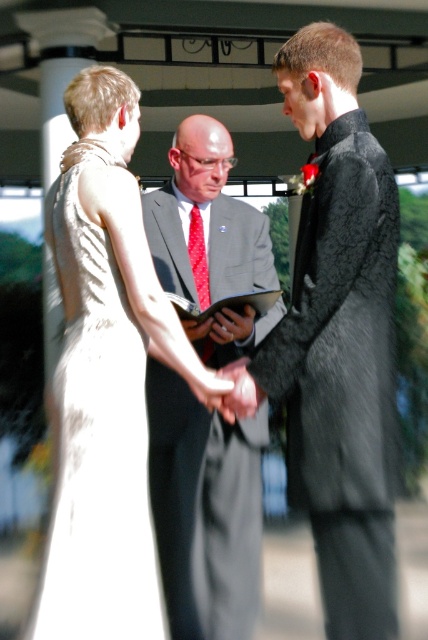
Question: Can you confirm if black textured suit at center is positioned above matte gray suit at center?

Choices:
 (A) yes
 (B) no

Answer: (A)

Question: Which point appears closest to the camera in this image?

Choices:
 (A) (345, 166)
 (B) (174, 161)
 (C) (104, 292)

Answer: (A)

Question: Estimate the real-world distances between objects in this image. Which object is closer to the matte gray suit at center?

Choices:
 (A) black textured suit at center
 (B) ivory satin dress at left

Answer: (B)

Question: Which object appears farthest from the camera in this image?

Choices:
 (A) ivory satin dress at left
 (B) matte gray suit at center
 (C) black textured suit at center

Answer: (B)

Question: Considering the relative positions of black textured suit at center and ivory satin dress at left in the image provided, where is black textured suit at center located with respect to ivory satin dress at left?

Choices:
 (A) left
 (B) right

Answer: (B)

Question: Is black textured suit at center wider than matte gray suit at center?

Choices:
 (A) yes
 (B) no

Answer: (B)